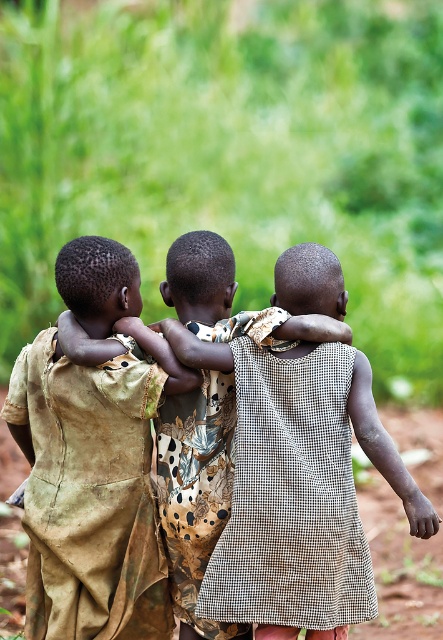
Can you confirm if brown textured cloth at center is smaller than checkered fabric dress at center?

Yes.

Where is `brown textured cloth at center`? The width and height of the screenshot is (443, 640). brown textured cloth at center is located at coordinates (89, 493).

What do you see at coordinates (89, 493) in the screenshot? The image size is (443, 640). I see `brown textured cloth at center` at bounding box center [89, 493].

In the scene shown: Is brown textured cloth at center to the left of brown dirt field at lower center from the viewer's perspective?

Yes, brown textured cloth at center is to the left of brown dirt field at lower center.

Between point (127, 449) and point (372, 630), which one is positioned in front?

Point (127, 449)

The width and height of the screenshot is (443, 640). Identify the location of brown textured cloth at center. (89, 493).

Who is shorter, checkered fabric dress at center or brown dirt field at lower center?

With less height is brown dirt field at lower center.

In the scene shown: Can you confirm if checkered fabric dress at center is positioned below brown dirt field at lower center?

No.

Is point (385, 476) less distant than point (399, 593)?

Yes, it is.

At what (x,y) coordinates should I click in order to perform the action: click on checkered fabric dress at center. Please return your answer as a coordinate pair (x, y). The width and height of the screenshot is (443, 640). Looking at the image, I should click on (292, 451).